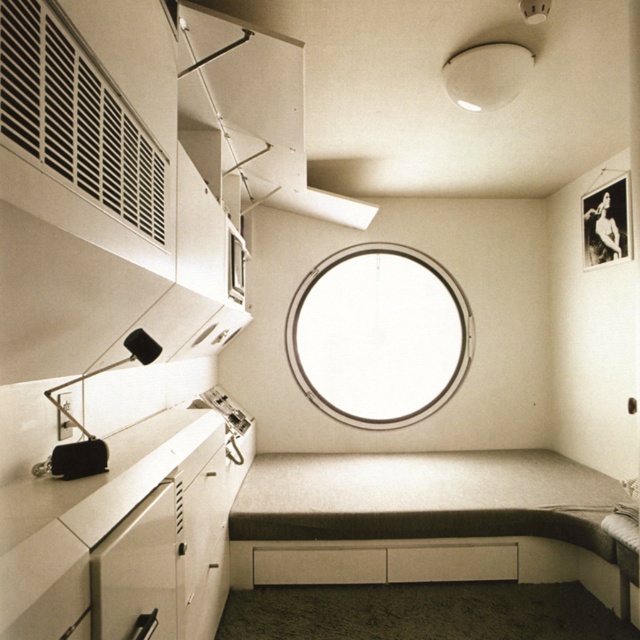
You are an interior designer assessing the lighting in this room. You have a new lamp with a shade that is 18 inches tall. The existing white matte lampshade at upper center is part of a lighting plan that needs to maintain a consistent height for all fixtures. Can the new lamp be placed where the white glass window at center is currently located without violating the height requirement?

The white glass window at center is taller than the white matte lampshade at upper center. Since the new lamp has a shade that is 18 inches tall, and the existing lampshade is shorter, replacing the window with the lamp would violate the height requirement because the window is taller and the lamp would be shorter than the required height.

You are standing in the room and want to reach both the point at coordinates (26, 28) and the point at coordinates (234, 260). Which point will you reach first?

You will reach the point at coordinates (26, 28) first because it is closer to you than the point at coordinates (234, 260).